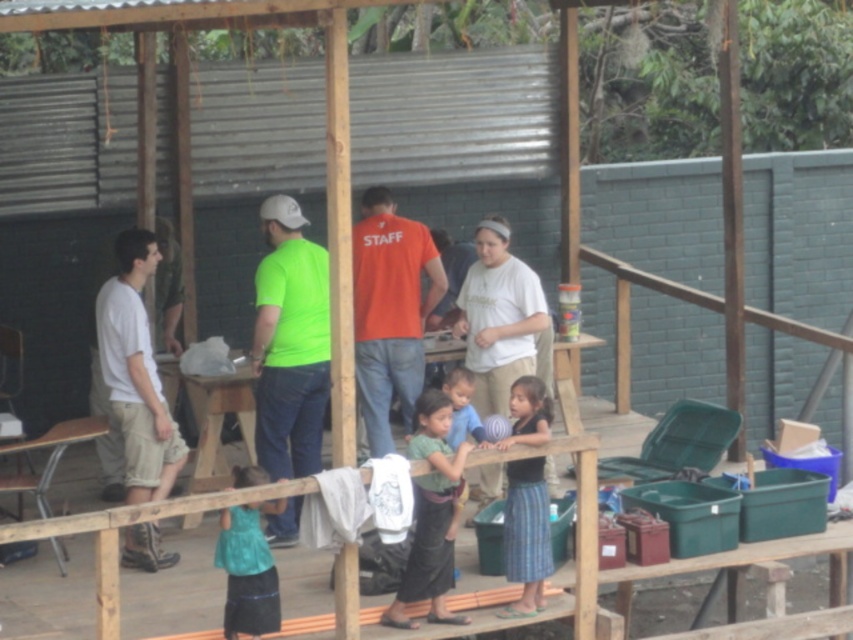
Does white cotton shirt at left have a lesser height compared to teal fabric skirt at lower center?

In fact, white cotton shirt at left may be taller than teal fabric skirt at lower center.

Does white cotton shirt at left lie behind teal fabric skirt at lower center?

That is True.

Locate an element on the screen. Image resolution: width=853 pixels, height=640 pixels. white cotton shirt at left is located at coordinates (136, 372).

Does point (415, 310) come farther from viewer compared to point (245, 627)?

Yes, point (415, 310) is farther from viewer.

Is matte green shirt at center to the right of teal fabric skirt at lower center from the viewer's perspective?

Yes, matte green shirt at center is to the right of teal fabric skirt at lower center.

Locate an element on the screen. The width and height of the screenshot is (853, 640). matte green shirt at center is located at coordinates (392, 316).

Between matte green shirt at center and white cotton shirt at left, which one has more height?

white cotton shirt at left

In the scene shown: Is matte green shirt at center thinner than white cotton shirt at left?

Incorrect, matte green shirt at center's width is not less than white cotton shirt at left's.

Which is in front, point (260, 376) or point (149, 547)?

Positioned in front is point (149, 547).

The width and height of the screenshot is (853, 640). Find the location of `matte green shirt at center`. matte green shirt at center is located at coordinates (392, 316).